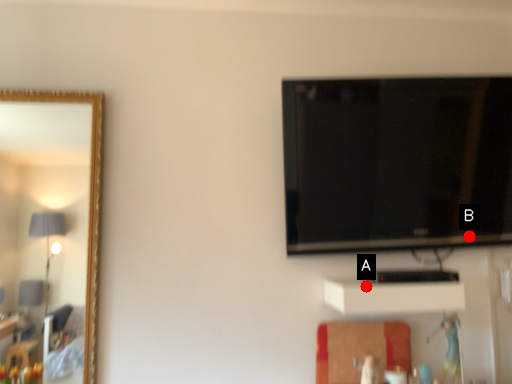
Question: Two points are circled on the image, labeled by A and B beside each circle. Which point is farther to the camera?

Choices:
 (A) A is further
 (B) B is further

Answer: (B)